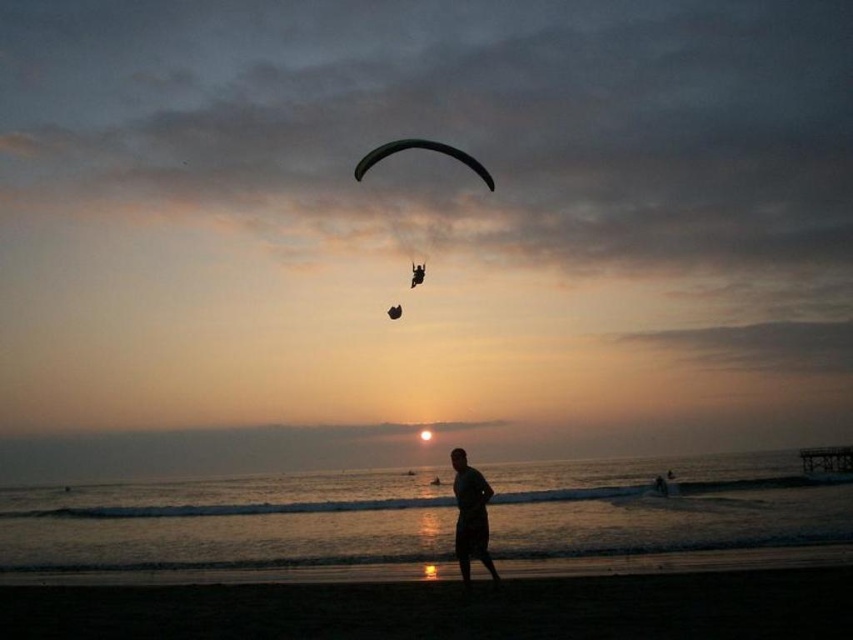
You are a photographer trying to capture the silhouette cotton shorts at center and the green fabric parachute at upper center in the same frame. Which object will appear closer to the camera in the photo?

The silhouette cotton shorts at center will appear closer to the camera because it is in front of the green fabric parachute at upper center.

You are a photographer trying to capture the silhouette cotton shorts at center and the green fabric parachute at upper center in the same frame. Based on their sizes in the image, which object would appear smaller in the photo?

The silhouette cotton shorts at center would appear smaller in the photo because its width is less than the green fabric parachute at upper center.